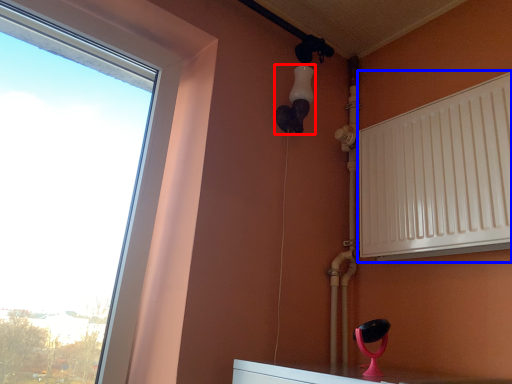
Question: Which point is closer to the camera, light fixture (highlighted by a red box) or radiator (highlighted by a blue box)?

Choices:
 (A) light fixture
 (B) radiator

Answer: (B)